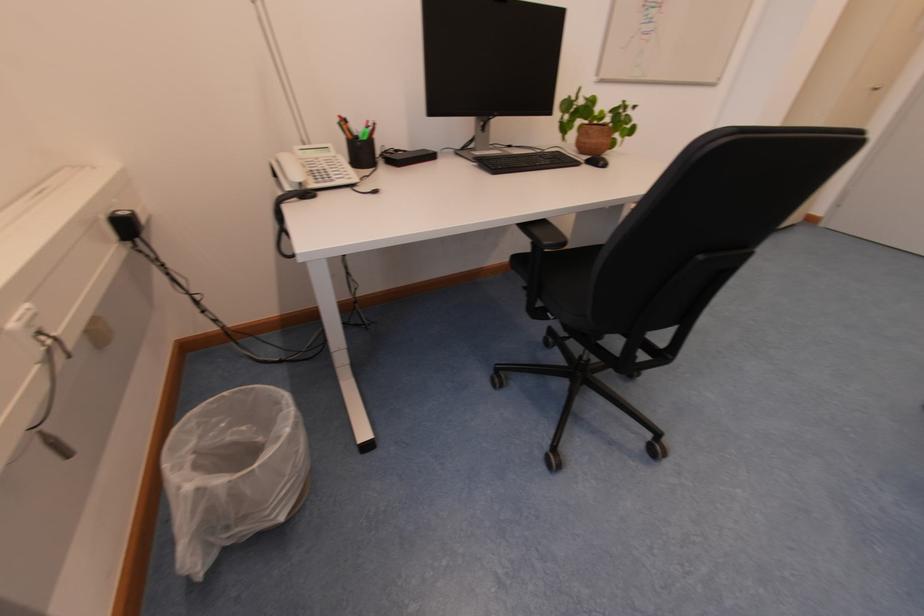
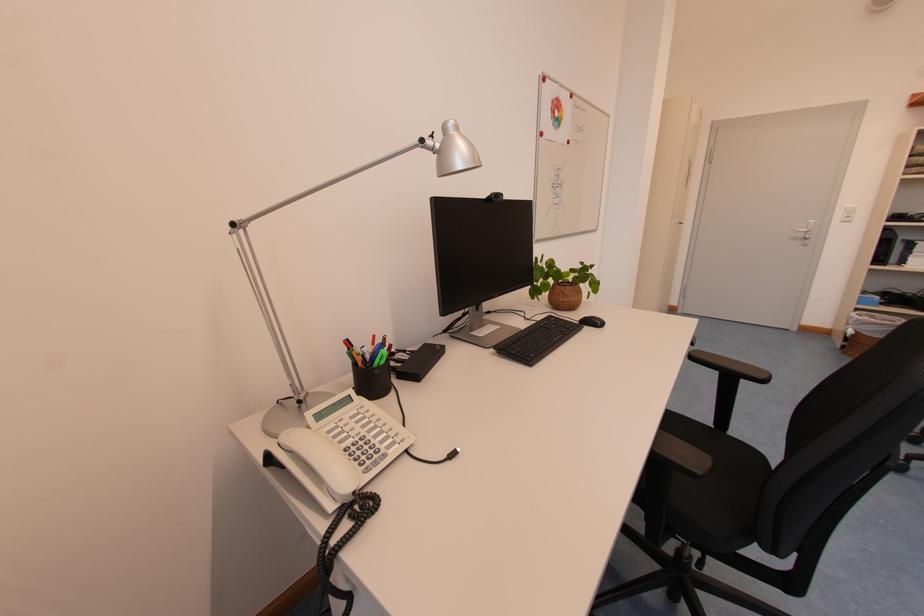
The first image is from the beginning of the video and the second image is from the end. How did the camera likely rotate when shooting the video?

The rotation direction of the camera is right-up.